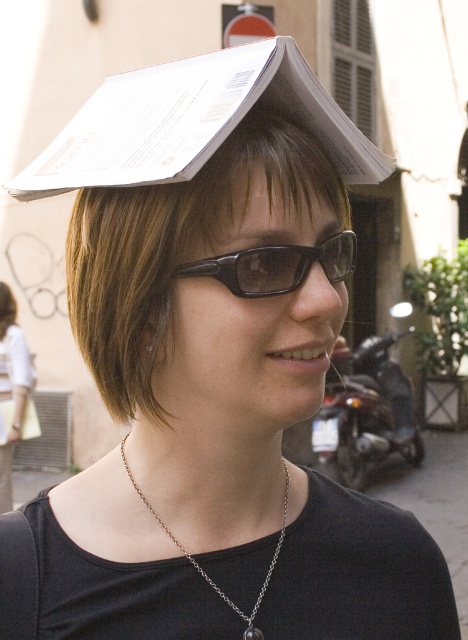
You are a fashion designer observing the person in the image. You need to determine which accessory is smaller between the black plastic glasses at center and the silver chain necklace at center. Which one is it?

The black plastic glasses at center has a smaller size compared to the silver chain necklace at center, so the black plastic glasses at center is the smaller accessory.

You are a photographer trying to capture a closeup of the silver chain necklace at center. However, the brown smooth hair at upper center is blocking your view. Based on the scene description, can you estimate if the hair is wider than the necklace?

The brown smooth hair at upper center might be wider than silver chain necklace at center, so there is a possibility that the hair is blocking the necklace and making it hard to capture in the photo.

You are a photographer trying to capture the perfect shot of the black plastic glasses at center. To ensure the glasses are centered in your photo, where should you position the camera? Please provide coordinates in the format of a point like this example format, but do not include units. The scene is viewed from the photographer standing directly in front of the glasses.

The black plastic glasses at center are located at point (x=276, y=266), so you should position the camera at that coordinate to center them in the photo.